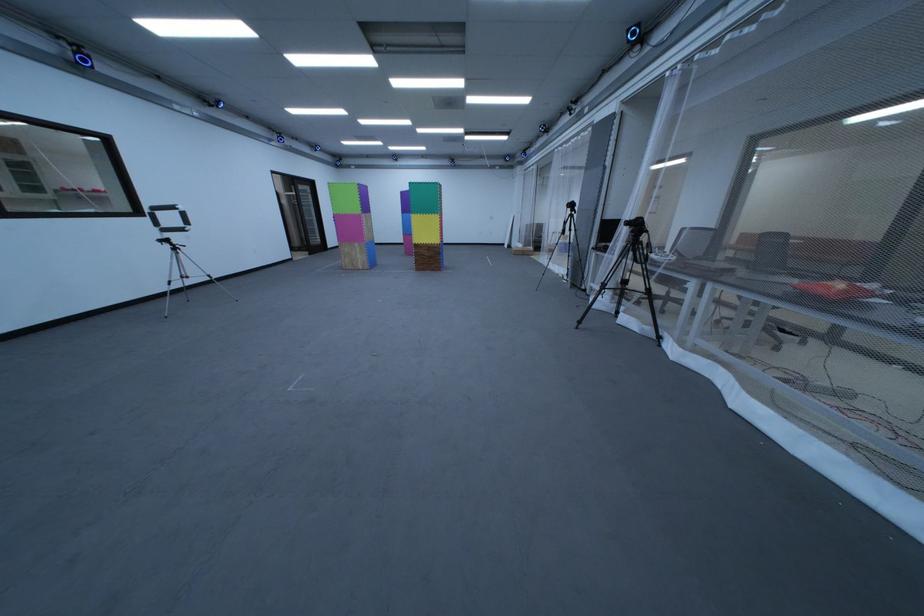
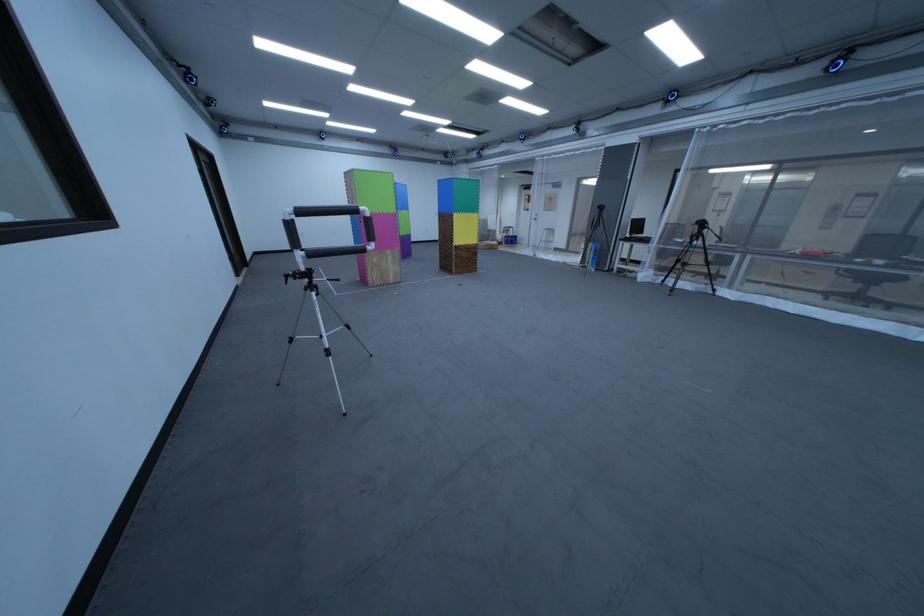
Where in the second image is the point corresponding to [593,246] from the first image?

(623, 238)